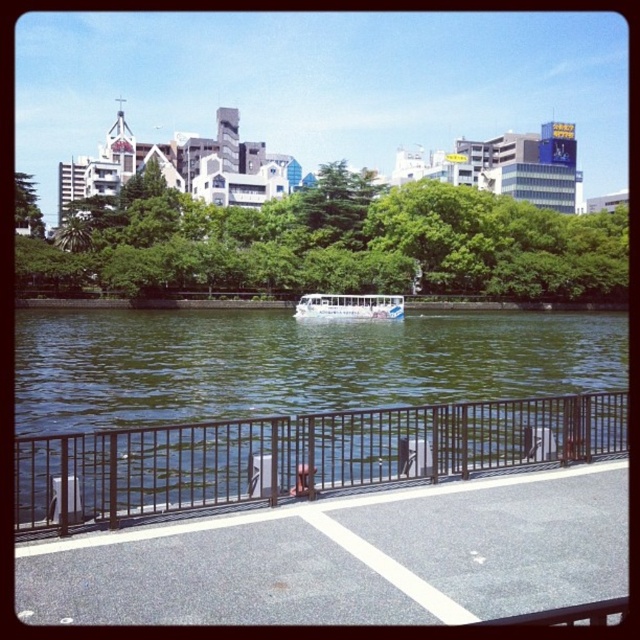
Question: From the image, what is the correct spatial relationship of green leafy tree at center in relation to brown metal fence at lower center?

Choices:
 (A) above
 (B) below

Answer: (A)

Question: Which object is the farthest from the green leafy tree at center?

Choices:
 (A) brown metal fence at lower center
 (B) white glossy boat at center

Answer: (A)

Question: Which point is closer to the camera taking this photo?

Choices:
 (A) (300, 316)
 (B) (64, 460)
 (C) (504, 276)

Answer: (B)

Question: Can you confirm if brown metal fence at lower center is positioned below white glossy boat at center?

Choices:
 (A) no
 (B) yes

Answer: (B)

Question: Is green leafy tree at center thinner than white glossy boat at center?

Choices:
 (A) no
 (B) yes

Answer: (A)

Question: Which object is the farthest from the green leafy tree at center?

Choices:
 (A) brown metal fence at lower center
 (B) white glossy boat at center

Answer: (A)